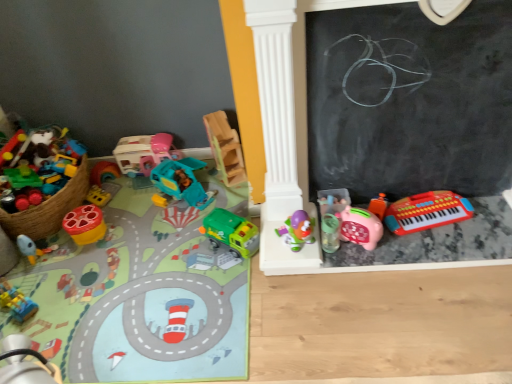
Identify the location of vacant space that's between shiny plastic toy at left, the tenth toy positioned from the right, and plastic yellow car at lower left, positioned as the 2th toy in left-to-right order. The image size is (512, 384). (61, 268).